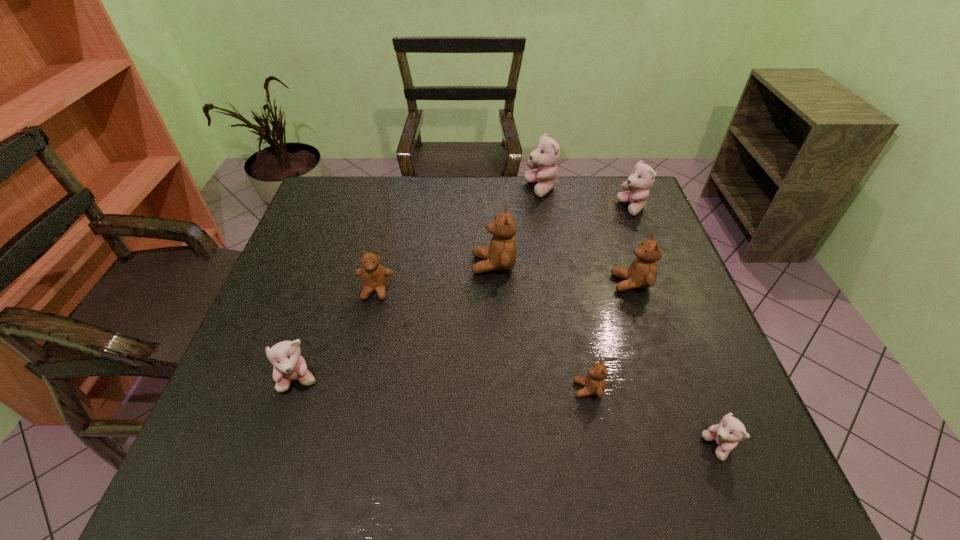
The image size is (960, 540). I want to click on blank region between the nearest brown teddy bear and the nearest object, so click(x=653, y=418).

You are a GUI agent. You are given a task and a screenshot of the screen. Output one action in this format:
    pyautogui.click(x=<x>, y=<y>)
    Task: Click on the vacant area that lies between the second brown teddy bear from left to right and the smallest pink teddy bear
    This screenshot has height=540, width=960.
    Given the screenshot: What is the action you would take?
    pyautogui.click(x=606, y=356)

The height and width of the screenshot is (540, 960). Find the location of `object that stands as the third closest to the third brown teddy bear from left to right`. object that stands as the third closest to the third brown teddy bear from left to right is located at coordinates (501, 255).

Where is `object that ranks as the second closest to the biggest pink teddy bear`? The height and width of the screenshot is (540, 960). object that ranks as the second closest to the biggest pink teddy bear is located at coordinates (501, 255).

Where is `teddy bear that stands as the fifth closest to the second biggest brown teddy bear`? teddy bear that stands as the fifth closest to the second biggest brown teddy bear is located at coordinates (726, 434).

Locate which teddy bear is the seventh closest to the second nearest pink teddy bear. Please provide its 2D coordinates. Your answer should be formatted as a tuple, i.e. [(x, y)], where the tuple contains the x and y coordinates of a point satisfying the conditions above.

[(642, 177)]

Image resolution: width=960 pixels, height=540 pixels. Find the location of `pink teddy bear that is the second nearest to the sixth teddy bear from right to left`. pink teddy bear that is the second nearest to the sixth teddy bear from right to left is located at coordinates [x=642, y=177].

Where is `pink teddy bear that is the second closest to the second biggest brown teddy bear`? The width and height of the screenshot is (960, 540). pink teddy bear that is the second closest to the second biggest brown teddy bear is located at coordinates tap(545, 157).

The width and height of the screenshot is (960, 540). In order to click on the third closest brown teddy bear to the biggest brown teddy bear in this screenshot , I will do click(594, 383).

Identify the location of brown teddy bear that is the nearest to the second biggest brown teddy bear. (594, 383).